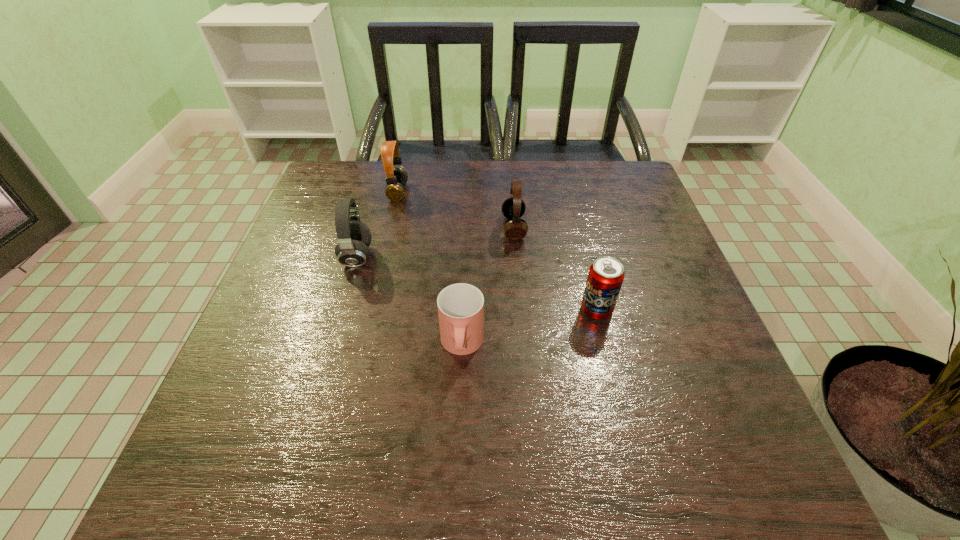
The width and height of the screenshot is (960, 540). Find the location of `vacant point located between the shortest object and the rightmost headset`. vacant point located between the shortest object and the rightmost headset is located at coordinates (488, 287).

You are a GUI agent. You are given a task and a screenshot of the screen. Output one action in this format:
    pyautogui.click(x=<x>, y=<y>)
    Task: Click on the free space between the soda can and the shortest object
    This screenshot has height=540, width=960.
    Given the screenshot: What is the action you would take?
    pyautogui.click(x=529, y=328)

What are the coordinates of `blank region between the farthest headset and the soda can` in the screenshot? It's located at (497, 251).

Where is `free point between the rightmost headset and the soda can`? The height and width of the screenshot is (540, 960). free point between the rightmost headset and the soda can is located at coordinates (555, 269).

Where is `free space between the farthest headset and the shortest object`? Image resolution: width=960 pixels, height=540 pixels. free space between the farthest headset and the shortest object is located at coordinates (430, 268).

The width and height of the screenshot is (960, 540). What are the coordinates of `free point between the fourth object from left to right and the rightmost object` in the screenshot? It's located at (555, 269).

You are a GUI agent. You are given a task and a screenshot of the screen. Output one action in this format:
    pyautogui.click(x=<x>, y=<y>)
    Task: Click on the vacant space in between the fourth object from left to right and the shortest object
    
    Given the screenshot: What is the action you would take?
    pyautogui.click(x=488, y=287)

At what (x,y) coordinates should I click in order to perform the action: click on empty space between the second object from right to left and the shortest object. Please return your answer as a coordinate pair (x, y). Looking at the image, I should click on (488, 287).

At what (x,y) coordinates should I click in order to perform the action: click on object that is the second closest to the farthest headset. Please return your answer as a coordinate pair (x, y). This screenshot has width=960, height=540. Looking at the image, I should click on (513, 208).

Select which object is the second closest to the cup. Please provide its 2D coordinates. Your answer should be formatted as a tuple, i.e. [(x, y)], where the tuple contains the x and y coordinates of a point satisfying the conditions above.

[(354, 237)]